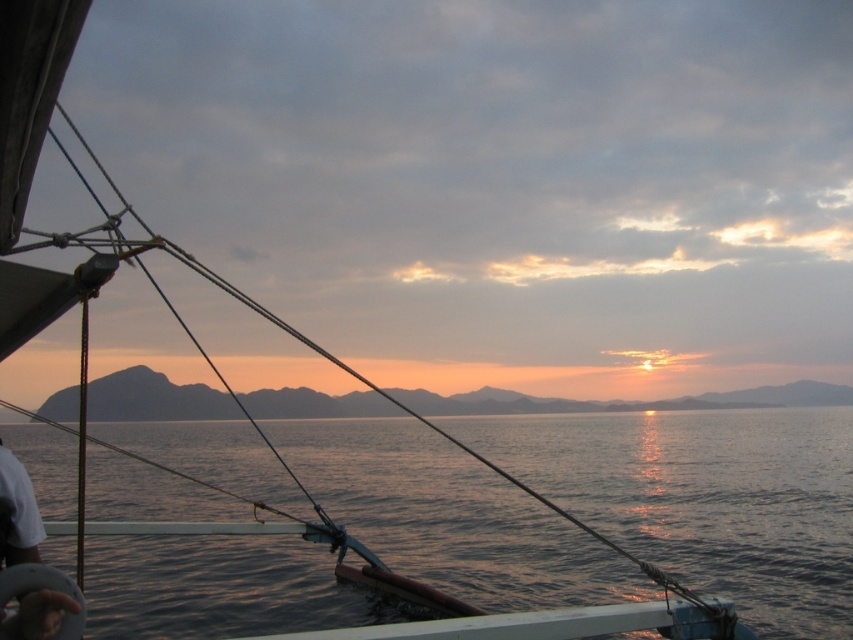
Question: Can you confirm if dark blue water at center is positioned below silvery metallic horizon at center?

Choices:
 (A) no
 (B) yes

Answer: (A)

Question: Which of the following is the farthest from the observer?

Choices:
 (A) (134, 634)
 (B) (373, 397)

Answer: (B)

Question: In this image, where is dark blue water at center located relative to silvery metallic horizon at center?

Choices:
 (A) above
 (B) below

Answer: (A)

Question: Can you confirm if dark blue water at center is positioned below silvery metallic horizon at center?

Choices:
 (A) no
 (B) yes

Answer: (A)